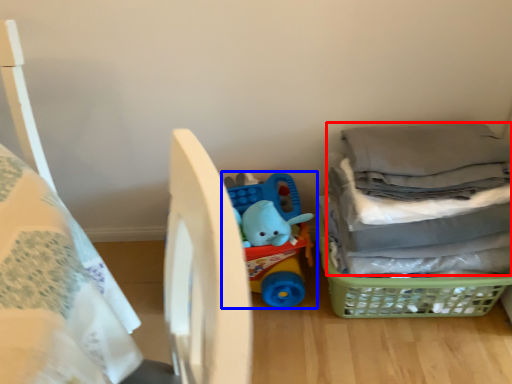
Question: Among these objects, which one is nearest to the camera, laundry (highlighted by a red box) or toy (highlighted by a blue box)?

Choices:
 (A) laundry
 (B) toy

Answer: (A)